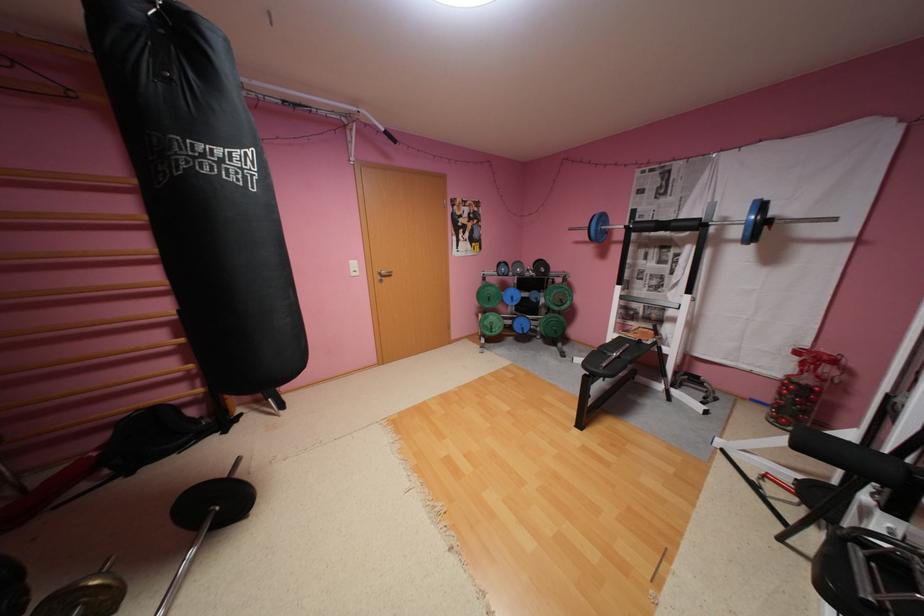
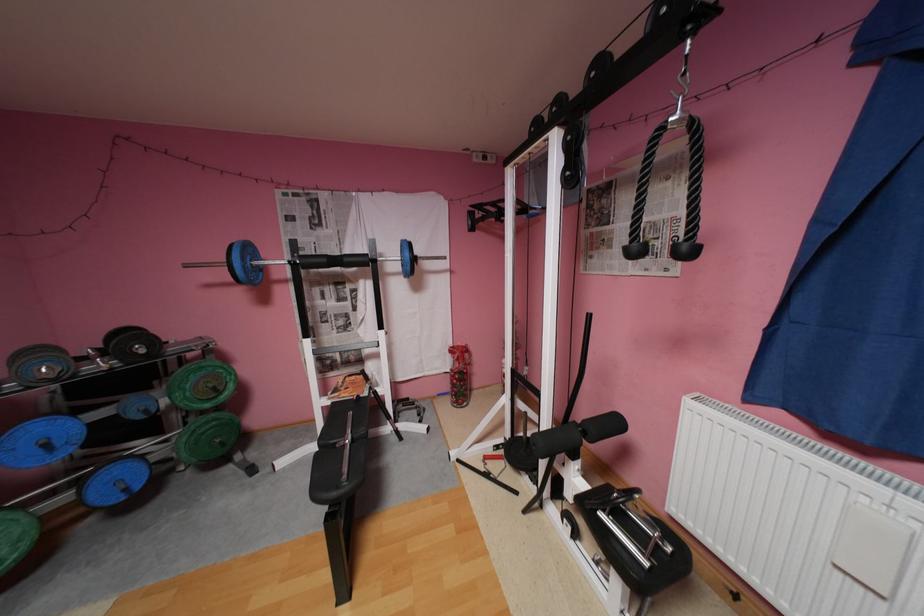
In the second image, find the point that corresponds to point (527, 262) in the first image.

(49, 351)